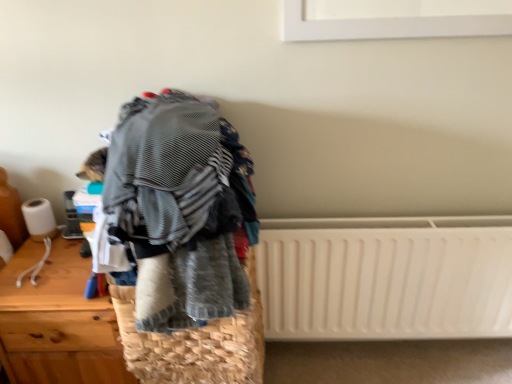
Question: Relative to striped fabric at center, is woven straw basket at center in front or behind?

Choices:
 (A) behind
 (B) front

Answer: (A)

Question: Is point (237, 352) positioned closer to the camera than point (230, 256)?

Choices:
 (A) farther
 (B) closer

Answer: (A)

Question: Estimate the real-world distances between objects in this image. Which object is closer to the striped fabric at center?

Choices:
 (A) white plastic radiator at lower right
 (B) woven straw basket at center
 (C) wooden chest of drawers at left

Answer: (B)

Question: Estimate the real-world distances between objects in this image. Which object is farther from the white plastic radiator at lower right?

Choices:
 (A) woven straw basket at center
 (B) striped fabric at center
 (C) wooden chest of drawers at left

Answer: (C)